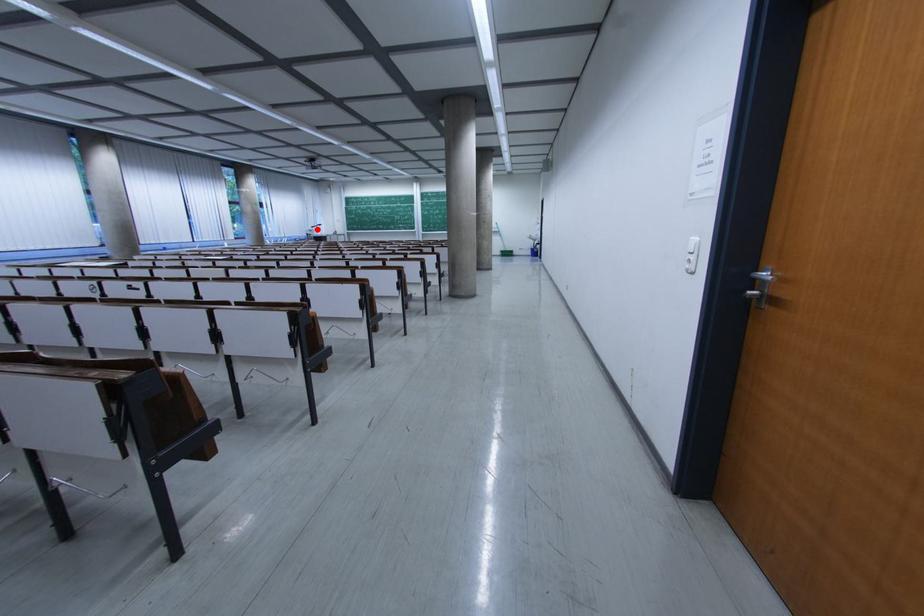
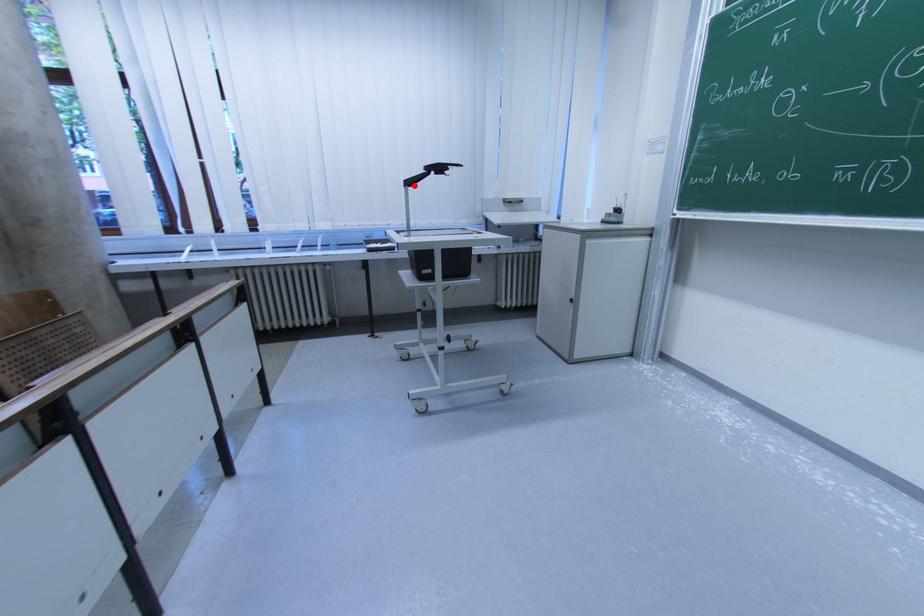
I am providing you with two images of the same scene from different viewpoints. A red point is marked on the first image and another point is marked on the second image. Does the point marked in image1 correspond to the same location as the one in image2?

Yes